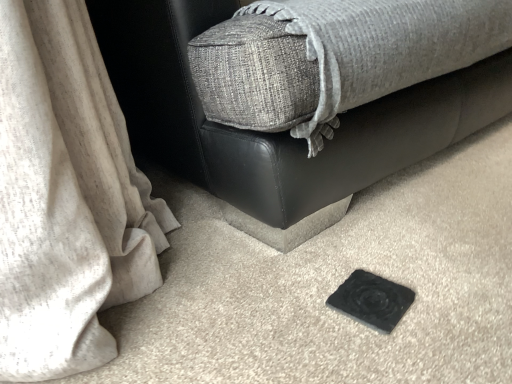
Where is `vacant point to the right of black rubber pad at lower center`? The width and height of the screenshot is (512, 384). vacant point to the right of black rubber pad at lower center is located at coordinates (448, 278).